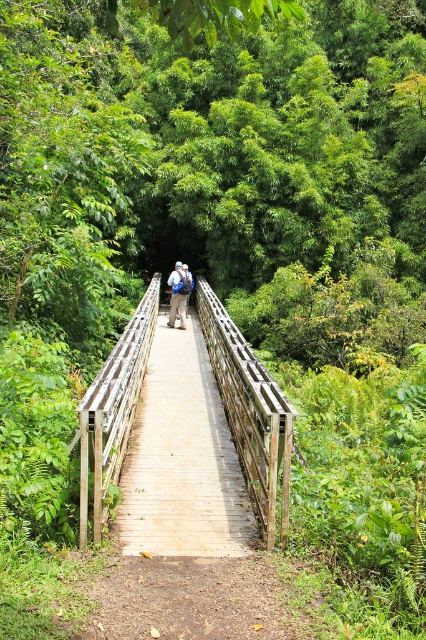
Who is higher up, wooden bridge at center or blue fabric backpack at center?

Positioned higher is blue fabric backpack at center.

Measure the distance between wooden bridge at center and camera.

A distance of 4.64 meters exists between wooden bridge at center and camera.

The height and width of the screenshot is (640, 426). I want to click on wooden bridge at center, so click(x=250, y=412).